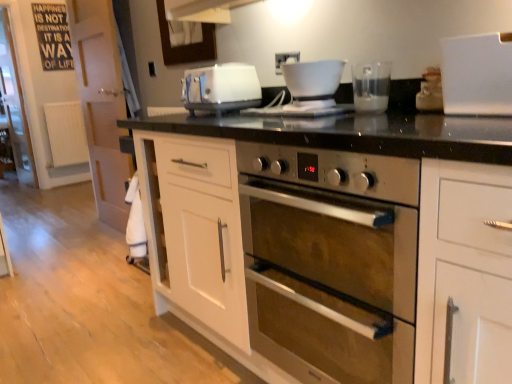
Question: Is white plastic container at upper right thinner than stainless steel oven at center?

Choices:
 (A) yes
 (B) no

Answer: (A)

Question: From a real-world perspective, is white plastic container at upper right over stainless steel oven at center?

Choices:
 (A) no
 (B) yes

Answer: (B)

Question: Is white plastic container at upper right facing towards stainless steel oven at center?

Choices:
 (A) yes
 (B) no

Answer: (B)

Question: Is white plastic container at upper right further to the viewer compared to stainless steel oven at center?

Choices:
 (A) no
 (B) yes

Answer: (B)

Question: Can we say white plastic container at upper right lies outside stainless steel oven at center?

Choices:
 (A) yes
 (B) no

Answer: (A)

Question: Looking at the image, does transparent plastic coffee machine at upper center, placed as the first coffee machine when sorted from right to left, seem bigger or smaller compared to transparent glass door at left, which is the first glass door from right to left?

Choices:
 (A) small
 (B) big

Answer: (A)

Question: Is transparent plastic coffee machine at upper center, positioned as the second coffee machine in left-to-right order, taller or shorter than transparent glass door at left, the second glass door viewed from the left?

Choices:
 (A) tall
 (B) short

Answer: (B)

Question: Considering the positions of point (388, 61) and point (78, 23), is point (388, 61) closer or farther from the camera than point (78, 23)?

Choices:
 (A) farther
 (B) closer

Answer: (B)

Question: Looking at their shapes, would you say transparent plastic coffee machine at upper center, placed as the first coffee machine when sorted from right to left, is wider or thinner than transparent glass door at left, the second glass door viewed from the left?

Choices:
 (A) wide
 (B) thin

Answer: (A)

Question: Would you say white plastic container at upper right is to the left or to the right of transparent glass door at left, the second glass door viewed from the left, in the picture?

Choices:
 (A) right
 (B) left

Answer: (A)

Question: Is white plastic container at upper right situated inside transparent glass door at left, the second glass door viewed from the left, or outside?

Choices:
 (A) outside
 (B) inside

Answer: (A)

Question: Looking at their shapes, would you say white plastic container at upper right is wider or thinner than transparent glass door at left, the 2th glass door when ordered from back to front?

Choices:
 (A) wide
 (B) thin

Answer: (A)

Question: Is white plastic container at upper right taller or shorter than transparent glass door at left, the second glass door viewed from the left?

Choices:
 (A) tall
 (B) short

Answer: (B)

Question: From their relative heights in the image, would you say white glossy bowl at upper center, placed as the second coffee machine when sorted from right to left, is taller or shorter than stainless steel oven at center?

Choices:
 (A) short
 (B) tall

Answer: (A)

Question: From the image's perspective, is white glossy bowl at upper center, placed as the second coffee machine when sorted from right to left, positioned above or below stainless steel oven at center?

Choices:
 (A) above
 (B) below

Answer: (A)